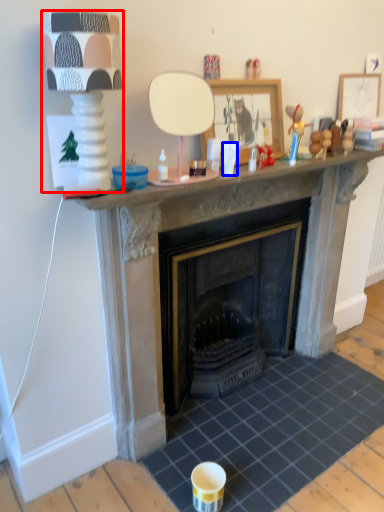
Question: Which object appears closest to the camera in this image, lamp (highlighted by a red box) or coffee cup (highlighted by a blue box)?

Choices:
 (A) lamp
 (B) coffee cup

Answer: (A)